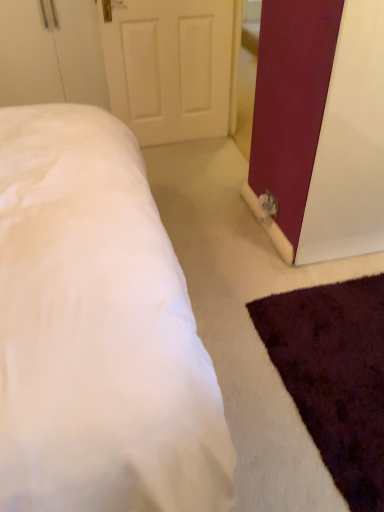
Image resolution: width=384 pixels, height=512 pixels. What do you see at coordinates (291, 101) in the screenshot?
I see `matte burgundy barn door at right` at bounding box center [291, 101].

This screenshot has height=512, width=384. I want to click on matte burgundy barn door at right, so click(291, 101).

The width and height of the screenshot is (384, 512). What do you see at coordinates (169, 67) in the screenshot?
I see `white matte door at upper center` at bounding box center [169, 67].

This screenshot has width=384, height=512. Find the location of `matte burgundy barn door at right`. matte burgundy barn door at right is located at coordinates (291, 101).

From the image's perspective, is white matte door at upper center positioned above or below matte burgundy barn door at right?

From the image's perspective, white matte door at upper center appears above matte burgundy barn door at right.

Is white matte door at upper center behind matte burgundy barn door at right?

Yes, white matte door at upper center is behind matte burgundy barn door at right.

The width and height of the screenshot is (384, 512). I want to click on door below the matte burgundy barn door at right (from a real-world perspective), so click(169, 67).

From a real-world perspective, who is located higher, white soft bed at lower left or matte burgundy barn door at right?

In real-world perspective, matte burgundy barn door at right is above.

Would you consider white soft bed at lower left to be distant from matte burgundy barn door at right?

white soft bed at lower left is near matte burgundy barn door at right, not far away.

Which object is positioned more to the right, white soft bed at lower left or matte burgundy barn door at right?

Positioned to the right is matte burgundy barn door at right.

From the image's perspective, which is below, white soft bed at lower left or matte burgundy barn door at right?

white soft bed at lower left appears lower in the image.

In terms of size, does white matte door at upper center appear bigger or smaller than white soft bed at lower left?

In the image, white matte door at upper center appears to be smaller than white soft bed at lower left.

Considering the sizes of objects white matte door at upper center and white soft bed at lower left in the image provided, who is taller, white matte door at upper center or white soft bed at lower left?

Standing taller between the two is white soft bed at lower left.

Is white matte door at upper center facing towards white soft bed at lower left?

Yes, white matte door at upper center is turned towards white soft bed at lower left.

Which is more to the left, white matte door at upper center or white soft bed at lower left?

From the viewer's perspective, white matte door at upper center appears more on the left side.

Which of these two, matte burgundy barn door at right or white soft bed at lower left, is bigger?

white soft bed at lower left.

From a real-world perspective, between matte burgundy barn door at right and white soft bed at lower left, who is vertically higher?

In real-world perspective, matte burgundy barn door at right is above.

From the picture: Considering the relative sizes of matte burgundy barn door at right and white soft bed at lower left in the image provided, is matte burgundy barn door at right wider than white soft bed at lower left?

No.

Is matte burgundy barn door at right taller than white soft bed at lower left?

Indeed, matte burgundy barn door at right has a greater height compared to white soft bed at lower left.

From a real-world perspective, is matte burgundy barn door at right located higher than white matte door at upper center?

Yes, from a real-world perspective, matte burgundy barn door at right is above white matte door at upper center.

In the scene shown: Is matte burgundy barn door at right with white matte door at upper center?

No, matte burgundy barn door at right is not touching white matte door at upper center.

Can you confirm if matte burgundy barn door at right is smaller than white matte door at upper center?

Incorrect, matte burgundy barn door at right is not smaller in size than white matte door at upper center.

From the image's perspective, is white soft bed at lower left below white matte door at upper center?

Yes, from the image's perspective, white soft bed at lower left is beneath white matte door at upper center.

How different are the orientations of white soft bed at lower left and white matte door at upper center in degrees?

The angular difference between white soft bed at lower left and white matte door at upper center is 90.2 degrees.

In terms of height, does white soft bed at lower left look taller or shorter compared to white matte door at upper center?

Considering their sizes, white soft bed at lower left has more height than white matte door at upper center.

I want to click on barn door located in front of the white matte door at upper center, so click(291, 101).

There is a white soft bed at lower left. Where is `barn door above it (from a real-world perspective)`? The height and width of the screenshot is (512, 384). barn door above it (from a real-world perspective) is located at coordinates (291, 101).

When comparing their distances from matte burgundy barn door at right, does white matte door at upper center or white soft bed at lower left seem closer?

white soft bed at lower left is closer to matte burgundy barn door at right.

Estimate the real-world distances between objects in this image. Which object is closer to white soft bed at lower left, white matte door at upper center or matte burgundy barn door at right?

The object closer to white soft bed at lower left is matte burgundy barn door at right.

Considering their positions, is white soft bed at lower left positioned further to matte burgundy barn door at right than white matte door at upper center?

white matte door at upper center is further to matte burgundy barn door at right.

Based on their spatial positions, is matte burgundy barn door at right or white soft bed at lower left closer to white matte door at upper center?

matte burgundy barn door at right lies closer to white matte door at upper center than the other object.

Which object lies nearer to the anchor point white matte door at upper center, white soft bed at lower left or matte burgundy barn door at right?

matte burgundy barn door at right is closer to white matte door at upper center.

Based on the photo, considering their positions, is matte burgundy barn door at right positioned closer to white soft bed at lower left than white matte door at upper center?

Among the two, matte burgundy barn door at right is located nearer to white soft bed at lower left.

Find the location of a particular element. barn door between white soft bed at lower left and white matte door at upper center from front to back is located at coordinates (291, 101).